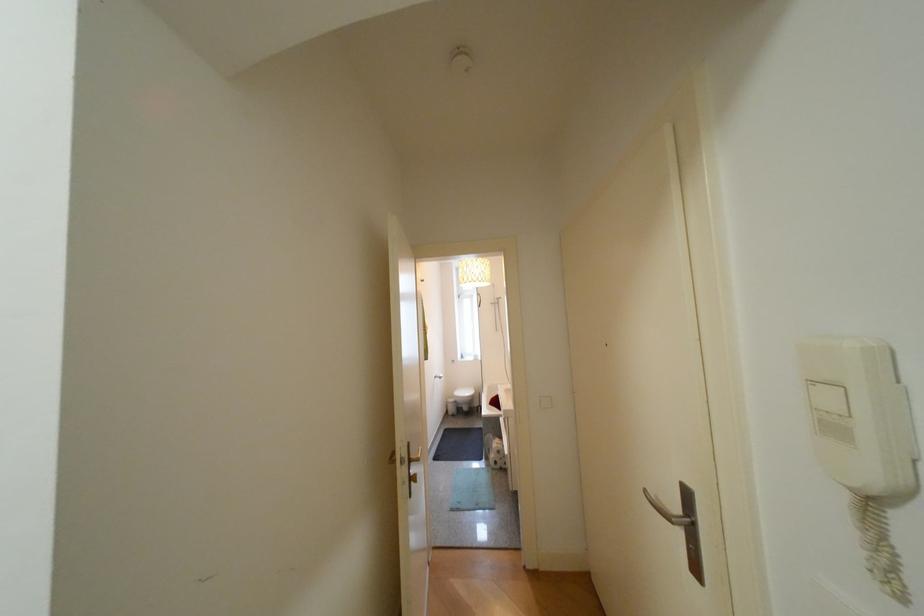
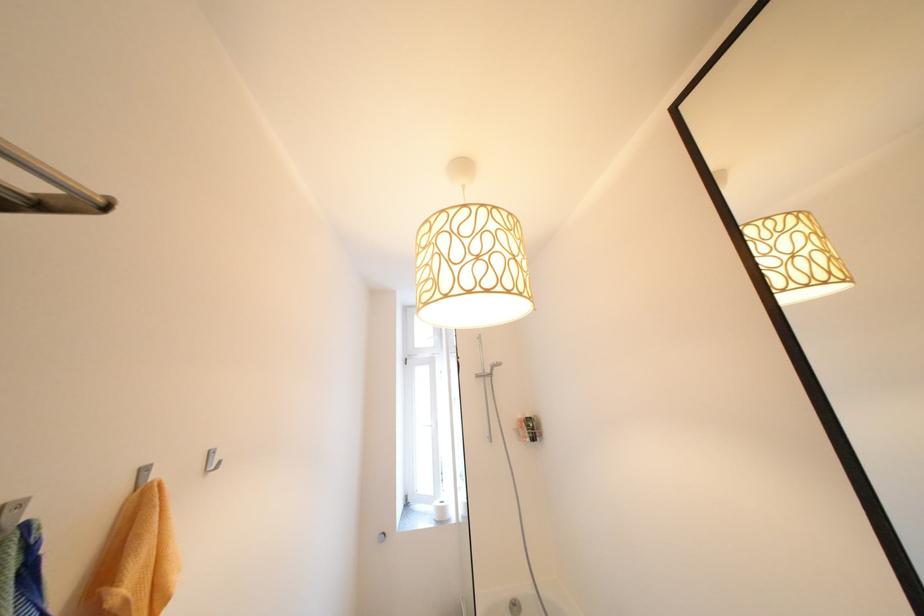
The point at (x=483, y=355) is marked in the first image. Where is the corresponding point in the second image?

(447, 504)